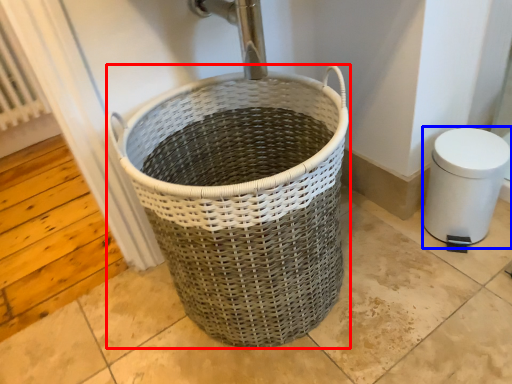
Question: Which object appears closest to the camera in this image, waste container (highlighted by a red box) or bidet (highlighted by a blue box)?

Choices:
 (A) waste container
 (B) bidet

Answer: (A)